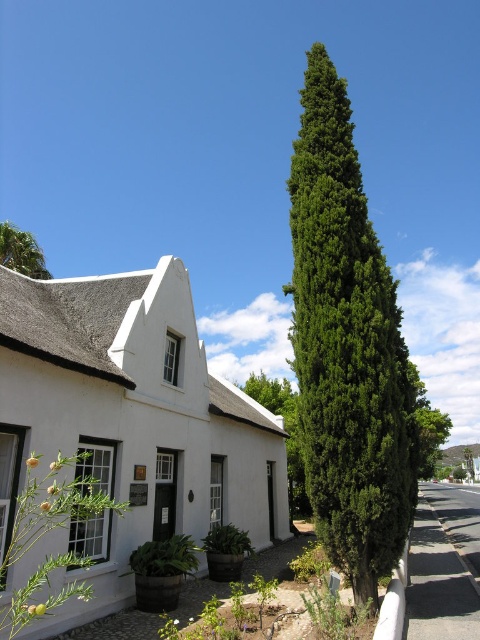
Question: Which point is farther to the camera?

Choices:
 (A) white matte house at center
 (B) green needle-like foliage at center
 (C) green leafy plant at lower left
 (D) green leafy bush at center

Answer: (D)

Question: Which point is farther to the camera?

Choices:
 (A) green leafy tree at upper left
 (B) green needle-like foliage at center
 (C) white matte house at center
 (D) green leafy plant at lower left

Answer: (A)

Question: Where is green leafy tree at upper left located in relation to green leafy bush at center in the image?

Choices:
 (A) left
 (B) right

Answer: (A)

Question: Where is green leafy plant at lower left located in relation to green leafy bush at center in the image?

Choices:
 (A) below
 (B) above

Answer: (B)

Question: Which point is farther from the camera taking this photo?

Choices:
 (A) [x=4, y=262]
 (B) [x=324, y=280]
 (C) [x=187, y=536]

Answer: (A)

Question: Is white matte house at center bigger than green leafy tree at upper left?

Choices:
 (A) yes
 (B) no

Answer: (B)